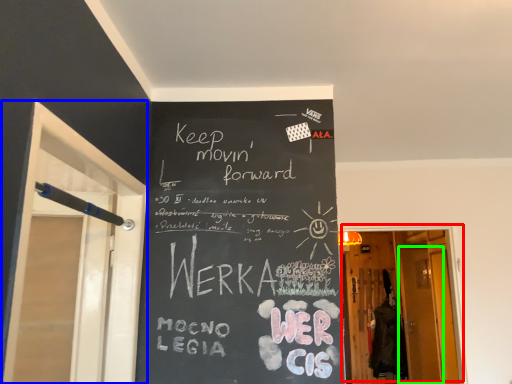
Question: Which object is positioned closest to door (highlighted by a red box)? Select from screen door (highlighted by a blue box) and screen door (highlighted by a green box).

Choices:
 (A) screen door
 (B) screen door

Answer: (B)